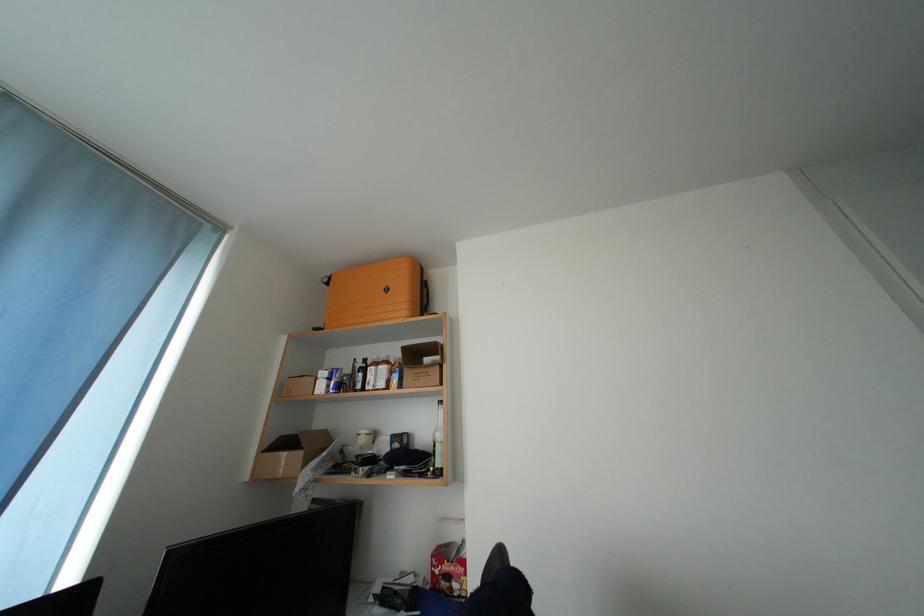
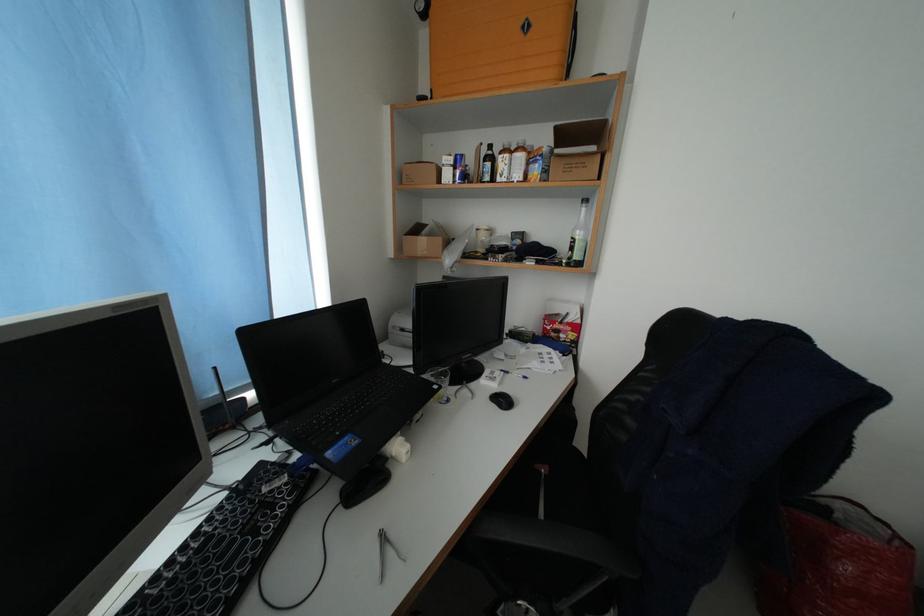
The point at (337, 384) is marked in the first image. Where is the corresponding point in the second image?

(464, 172)